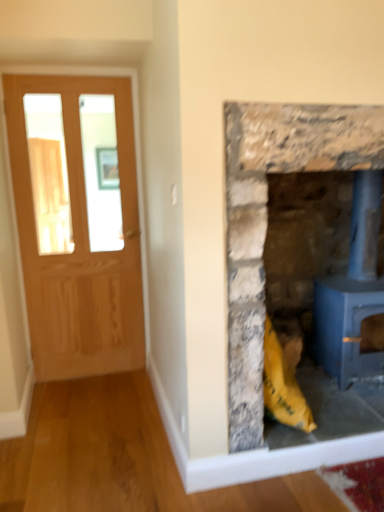
The image size is (384, 512). Identify the location of free space above matte wooden door at left (from a real-world perspective). (78, 71).